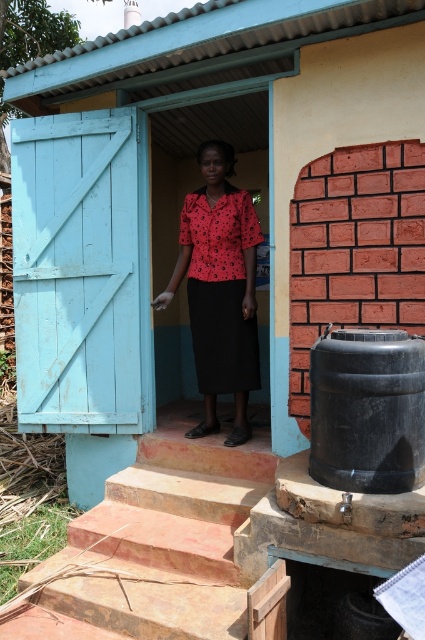
You are standing at the entrance of the building and want to climb the stairs. Based on the coordinates provided, in which direction should you move relative to the building to reach the terracotta stone stairs at center?

The terracotta stone stairs at center are located at coordinates point (153, 547), so you should move towards the center of the scene to reach them.

You are standing at the entrance of the building and want to place a small potted plant between the terracotta stone stairs at center and the black plastic barrel at lower right. Based on their positions, which object should the plant be closer to?

The terracotta stone stairs at center is in front of the black plastic barrel at lower right, so the plant should be placed closer to the black plastic barrel at lower right to be between them.

You are standing at the entrance of the building and want to place a small package on the black plastic barrel at lower right without moving the red floral blouse at center. Is the barrel accessible from your current position?

The black plastic barrel at lower right is in front of the red floral blouse at center, so it should be accessible from your current position at the entrance without needing to move the blouse.